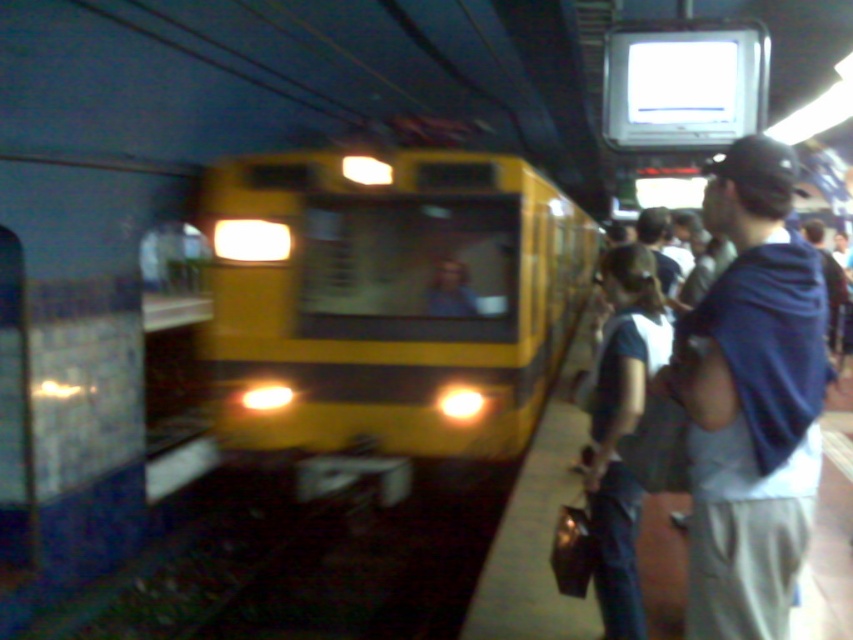
Is point (225, 348) positioned before point (712, 518)?

No, it is not.

Who is more forward, (393,182) or (802,417)?

Point (802,417) is more forward.

Is point (505, 218) behind point (732, 433)?

Yes, point (505, 218) is behind point (732, 433).

Locate an element on the screen. The height and width of the screenshot is (640, 853). yellow matte train at center is located at coordinates (387, 300).